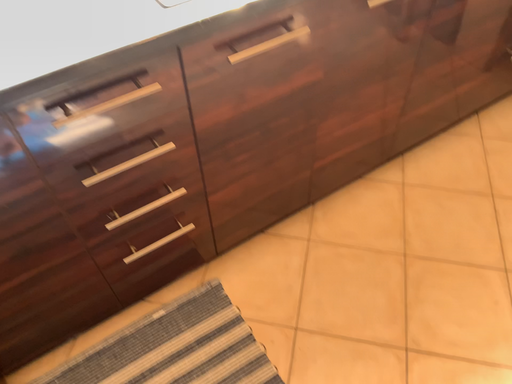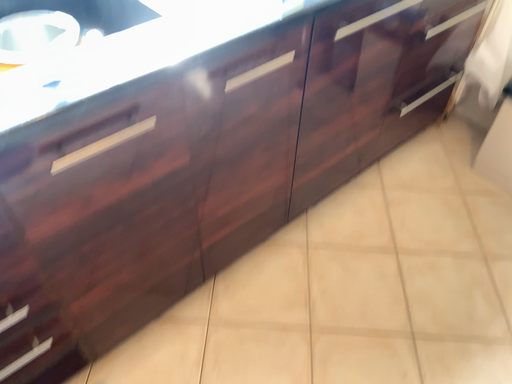
Question: Which way did the camera rotate in the video?

Choices:
 (A) rotated left
 (B) rotated right

Answer: (B)